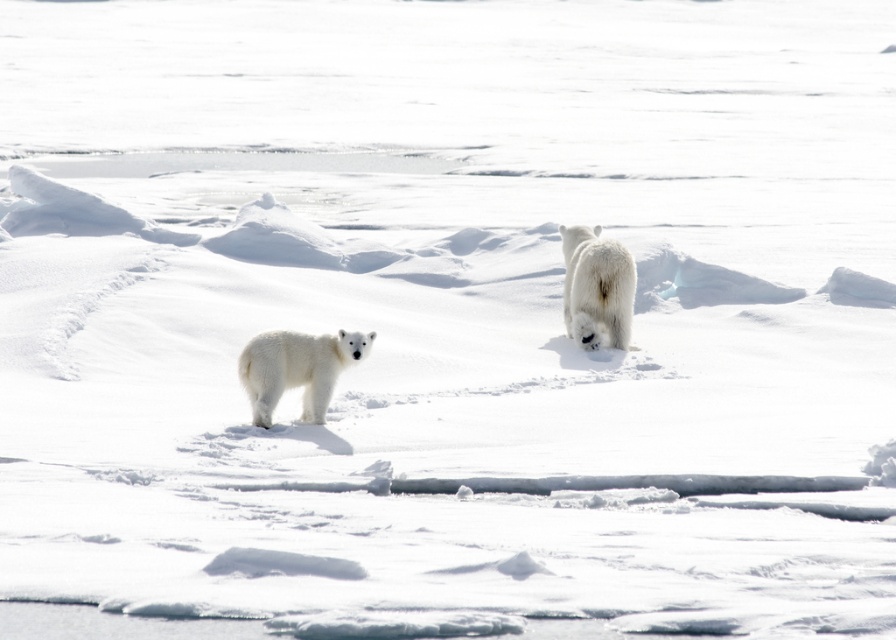
Question: Does white fluffy bear at center appear over white fur bear at center?

Choices:
 (A) no
 (B) yes

Answer: (A)

Question: Which point is closer to the camera?

Choices:
 (A) white fur bear at center
 (B) white fluffy bear at center

Answer: (B)

Question: Which point is farther to the camera?

Choices:
 (A) (617, 244)
 (B) (323, 353)

Answer: (A)

Question: Is white fluffy bear at center further to the viewer compared to white fur bear at center?

Choices:
 (A) yes
 (B) no

Answer: (B)

Question: From the image, what is the correct spatial relationship of white fluffy bear at center in relation to white fur bear at center?

Choices:
 (A) right
 (B) left

Answer: (B)

Question: Which of the following is the farthest from the observer?

Choices:
 (A) white fur bear at center
 (B) white fluffy bear at center

Answer: (A)